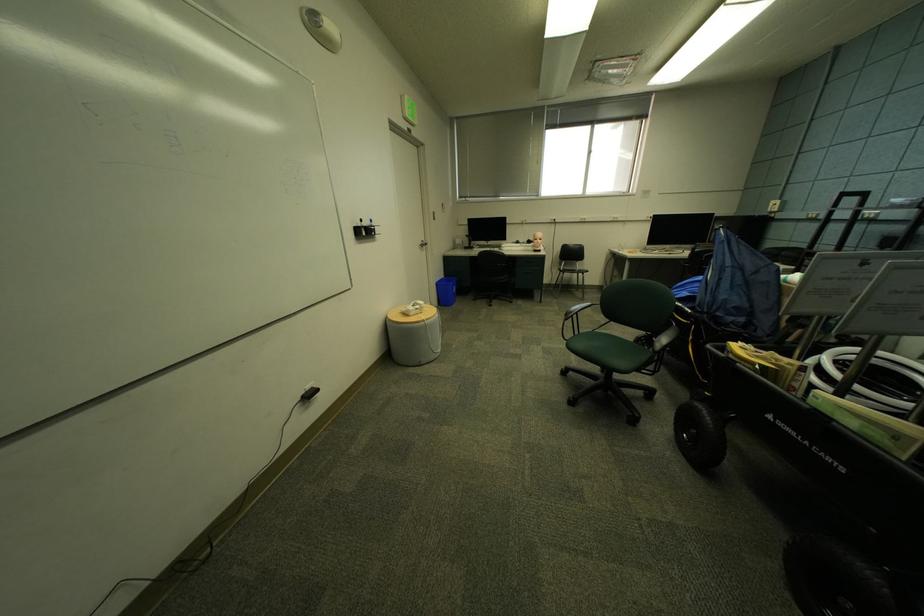
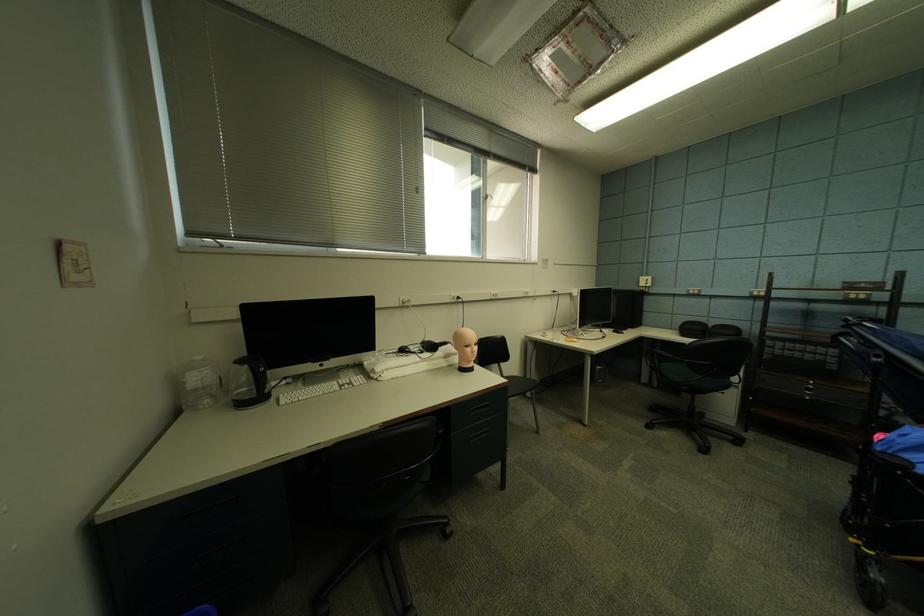
Find the pixel in the second image that matches (x=780, y=206) in the first image.

(650, 282)